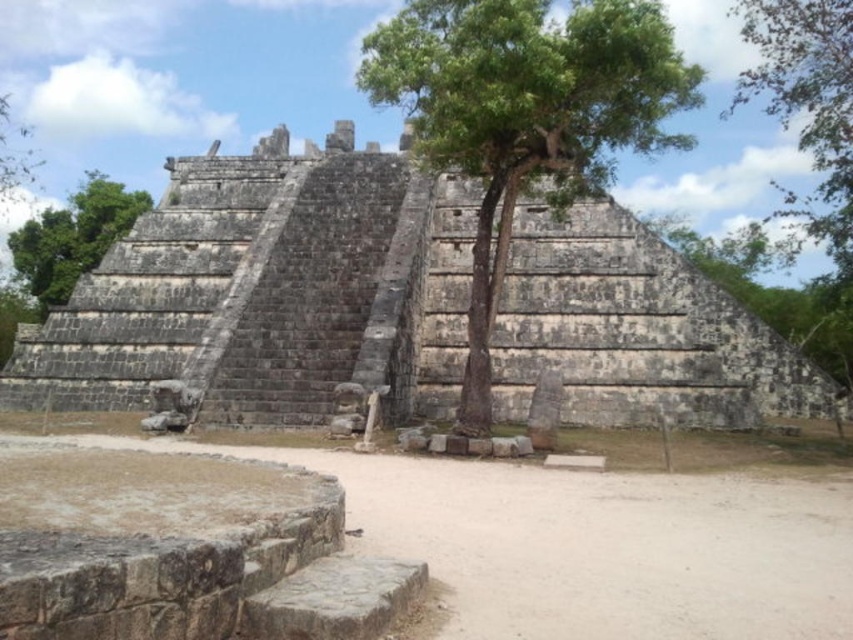
Question: In this image, where is green rough stone tree at center located relative to green leafy tree at upper right?

Choices:
 (A) below
 (B) above

Answer: (A)

Question: Can you confirm if green rough stone tree at center is positioned to the right of green leafy tree at left?

Choices:
 (A) yes
 (B) no

Answer: (A)

Question: Estimate the real-world distances between objects in this image. Which object is closer to the green rough stone tree at center?

Choices:
 (A) gray stone ruins at center
 (B) green leafy tree at upper right
 (C) green leafy tree at upper left

Answer: (A)

Question: Which object appears farthest from the camera in this image?

Choices:
 (A) green leafy tree at upper right
 (B) gray stone ruins at center

Answer: (A)

Question: Is gray stone ruins at center smaller than green leafy tree at left?

Choices:
 (A) yes
 (B) no

Answer: (A)

Question: Among these objects, which one is nearest to the camera?

Choices:
 (A) green leafy tree at left
 (B) gray stone ruins at center

Answer: (B)